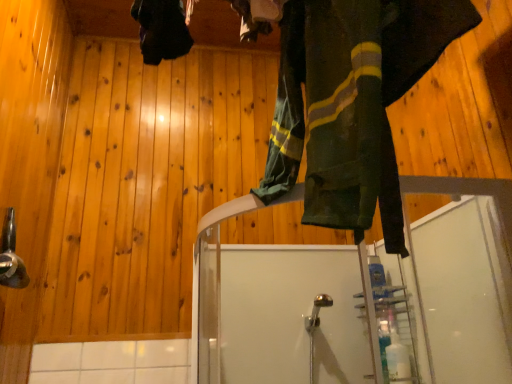
Question: Considering their positions, is green fabric pants at upper center located in front of or behind brushed metal shower head at left?

Choices:
 (A) front
 (B) behind

Answer: (A)

Question: Would you say green fabric pants at upper center is to the left or to the right of brushed metal shower head at left in the picture?

Choices:
 (A) left
 (B) right

Answer: (B)

Question: Is point (358, 19) positioned closer to the camera than point (25, 276)?

Choices:
 (A) farther
 (B) closer

Answer: (B)

Question: From the image's perspective, is brushed metal shower head at left positioned above or below green fabric pants at upper center?

Choices:
 (A) above
 (B) below

Answer: (B)

Question: Is brushed metal shower head at left spatially inside green fabric pants at upper center, or outside of it?

Choices:
 (A) inside
 (B) outside

Answer: (B)

Question: Considering their positions, is brushed metal shower head at left located in front of or behind green fabric pants at upper center?

Choices:
 (A) behind
 (B) front

Answer: (A)

Question: Does point (3, 226) appear closer or farther from the camera than point (362, 117)?

Choices:
 (A) closer
 (B) farther

Answer: (B)